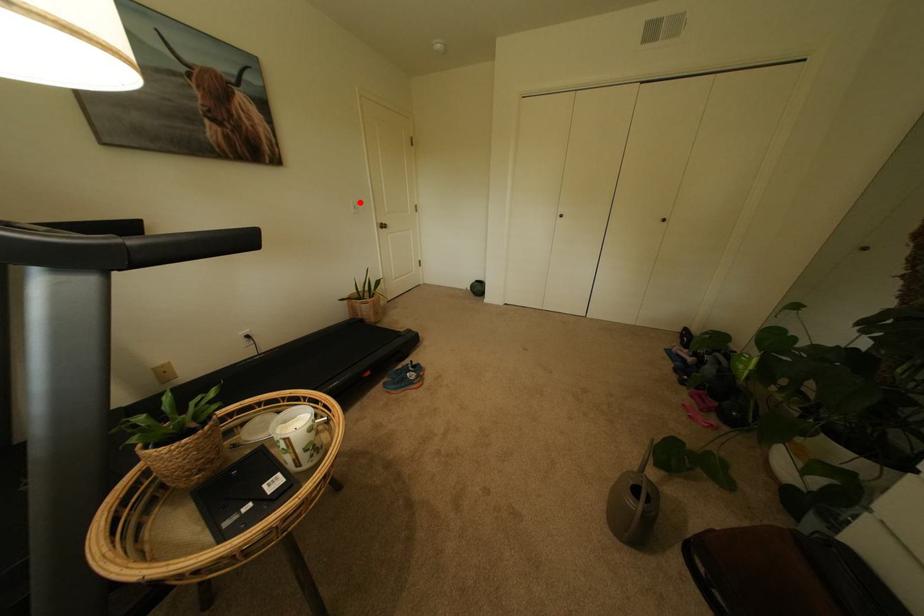
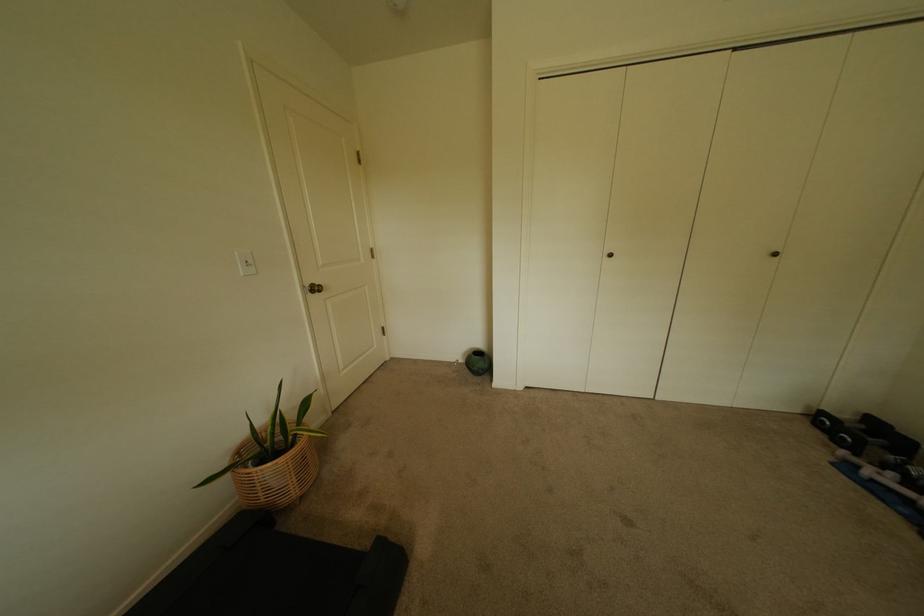
Question: I am providing you with two images of the same scene from different viewpoints. Image1 has a red point marked. In image2, the corresponding 3D location appears at what relative position? Reply with the corresponding letter.

Choices:
 (A) Closer
 (B) Farther

Answer: (B)